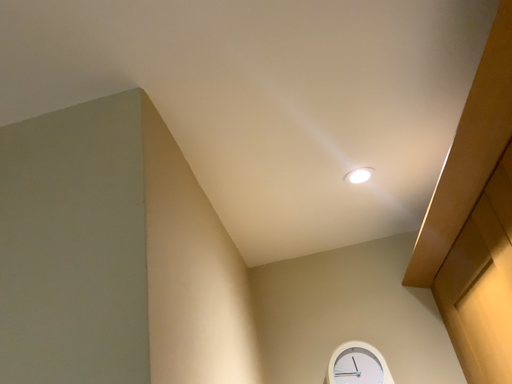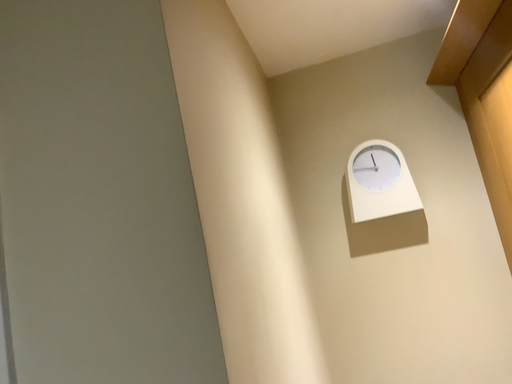
Question: How did the camera likely rotate when shooting the video?

Choices:
 (A) rotated downward
 (B) rotated upward

Answer: (A)